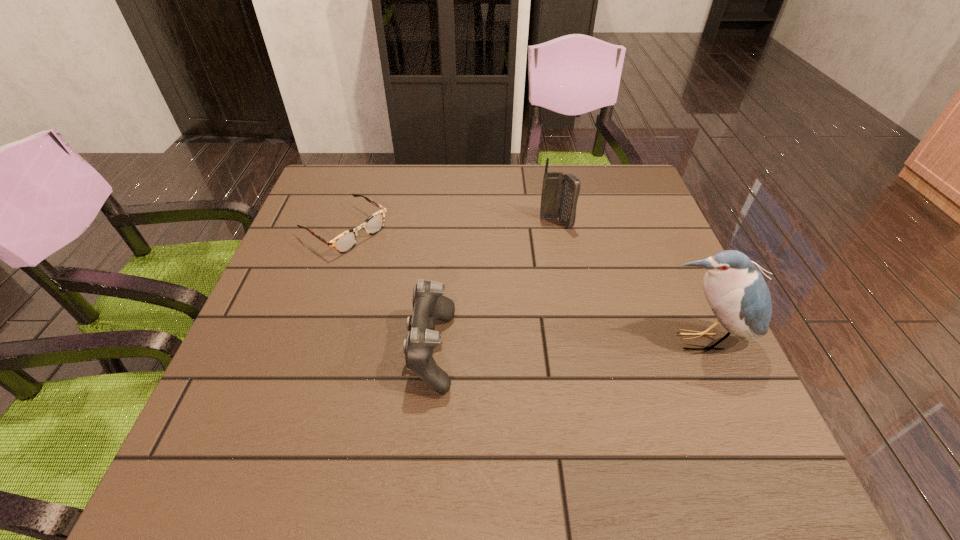
Where is `free spot on the desktop that is between the third tallest object and the rightmost object and is positioned on the frame of the shortest object`? free spot on the desktop that is between the third tallest object and the rightmost object and is positioned on the frame of the shortest object is located at coordinates (530, 347).

You are a GUI agent. You are given a task and a screenshot of the screen. Output one action in this format:
    pyautogui.click(x=<x>, y=<y>)
    Task: Click on the free space on the desktop that is between the third tallest object and the rightmost object and is positioned on the keyboard of the second object from right to left
    
    Given the screenshot: What is the action you would take?
    pyautogui.click(x=581, y=346)